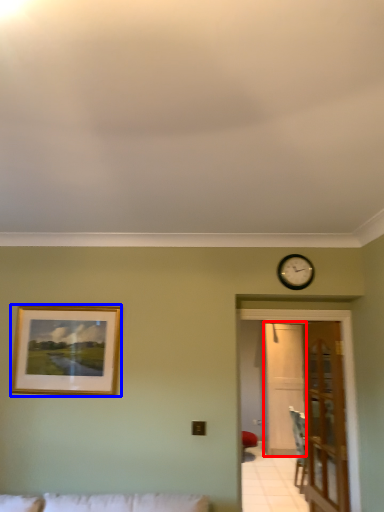
Question: Among these objects, which one is nearest to the camera, glass door (highlighted by a red box) or picture frame (highlighted by a blue box)?

Choices:
 (A) glass door
 (B) picture frame

Answer: (B)